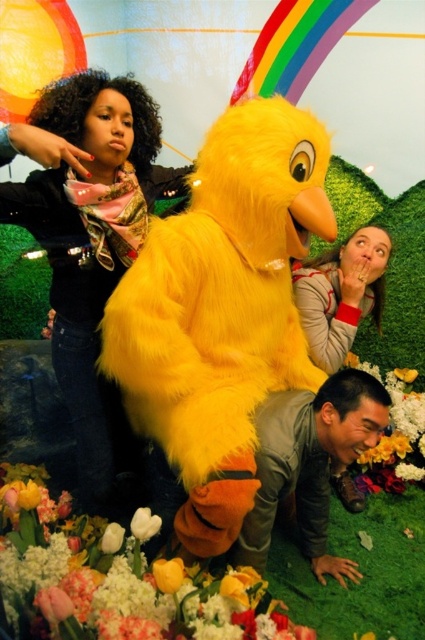
Question: Estimate the real-world distances between objects in this image. Which object is closer to the yellow fabric flower at lower center?

Choices:
 (A) fluffy yellow bird at center
 (B) soft yellow petals at lower center
 (C) white matte flower at lower left

Answer: (A)

Question: Does matte gray sweater at center appear over yellow matte flower at lower center?

Choices:
 (A) yes
 (B) no

Answer: (A)

Question: Which of the following is the closest to the observer?

Choices:
 (A) (405, 452)
 (B) (180, 561)
 (C) (76, 596)
 (D) (257, 438)

Answer: (C)

Question: Which point is closer to the camera taking this photo?

Choices:
 (A) (146, 540)
 (B) (370, 365)
 (C) (138, 179)

Answer: (A)

Question: From the image, what is the correct spatial relationship of fluffy yellow bird at center in relation to white matte flower at lower left?

Choices:
 (A) above
 (B) below

Answer: (A)

Question: In this image, where is yellow matte flower at lower center located relative to white matte tulip at center?

Choices:
 (A) below
 (B) above

Answer: (A)